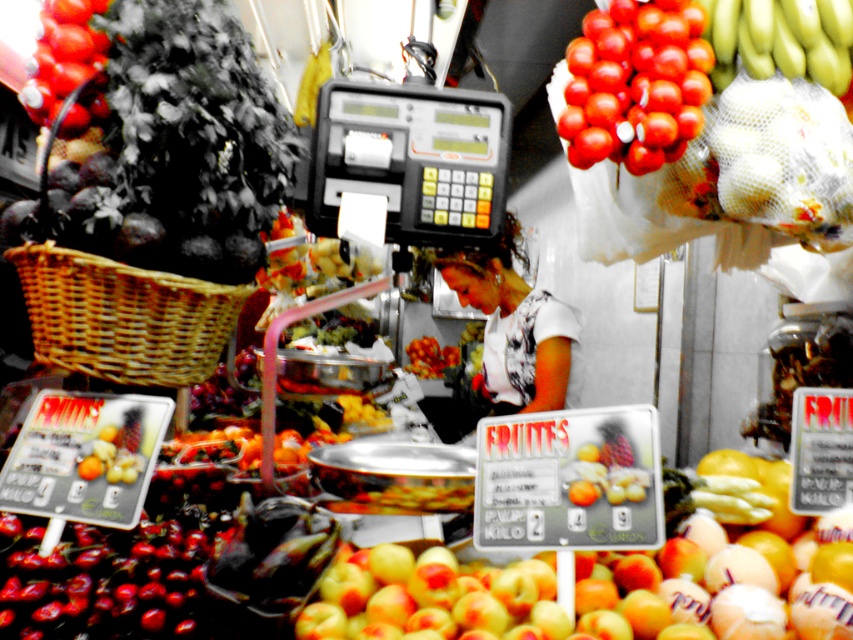
You are at the fruit stall and want to pick up two items located at the coordinates point (498, 97) and point (610, 58). Which item is closer to you?

Point (610, 58) is closer to you because point (498, 97) is behind it.

You are a customer at the fruit stall. You want to pick up the woven brown basket at lower left and the shiny green bananas at upper right. Which one is closer to your hand if you reach down first?

The woven brown basket at lower left is closer to your hand since it is located below the shiny green bananas at upper right.